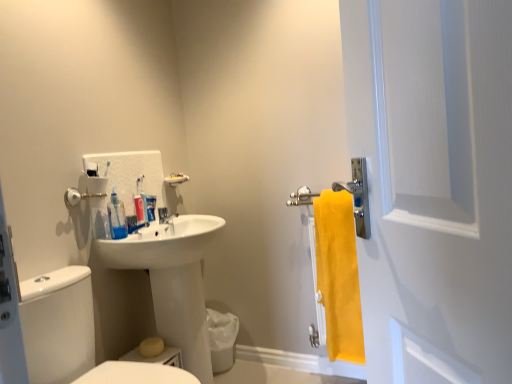
I want to click on vacant area located to the right-hand side of transparent plastic mouthwash at center, so click(159, 231).